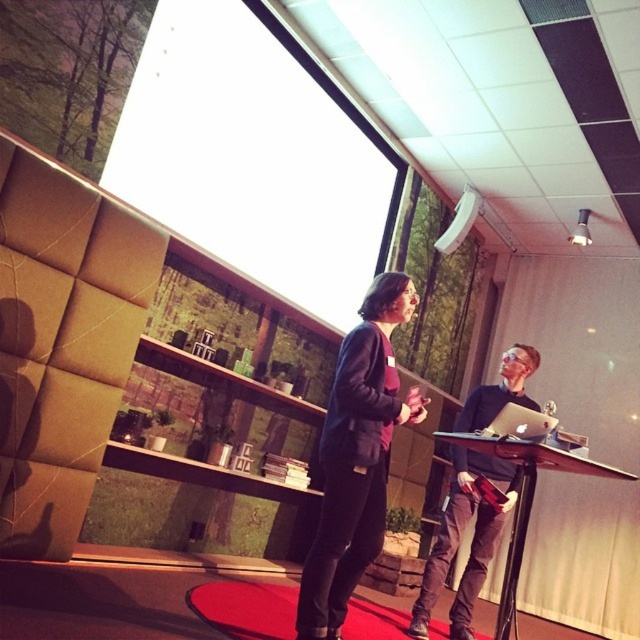
You are a photographer standing in the conference room. You want to take a photo of the white glossy projection screen at upper center without including any of the two people in the frame. Given that you are currently at the camera position, can you step back to capture the screen without the people in the shot?

The white glossy projection screen at upper center is 3.03 meters away from the camera. By stepping back, you can adjust your position to frame the screen while excluding the two people in the scene, as the distance allows sufficient space to recompose the shot without them appearing in the frame.

Consider the image. You are an attendee at a conference and need to present your slides. You see the white glossy projection screen at upper center and the matte black laptop at right. Which device should you connect your presentation to in order to display it on the screen?

You should connect your presentation to the matte black laptop at right because the white glossy projection screen at upper center is positioned on the left side of it, indicating that the laptop is likely connected to the screen for presentations.